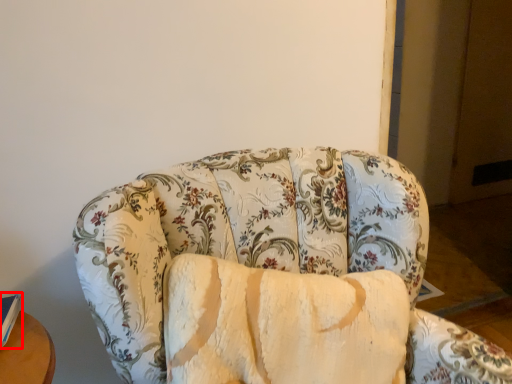
Question: Observing the image, what is the correct spatial positioning of book (annotated by the red box) in reference to studio couch?

Choices:
 (A) right
 (B) left

Answer: (B)